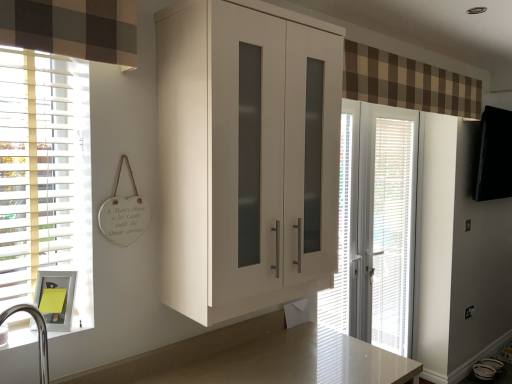
Question: Does white glossy cabinet at center have a smaller size compared to brown checkered fabric at upper center?

Choices:
 (A) yes
 (B) no

Answer: (B)

Question: Considering the relative sizes of white glossy cabinet at center and brown checkered fabric at upper center in the image provided, is white glossy cabinet at center taller than brown checkered fabric at upper center?

Choices:
 (A) yes
 (B) no

Answer: (A)

Question: Could you tell me if white glossy cabinet at center is turned towards brown checkered fabric at upper center?

Choices:
 (A) no
 (B) yes

Answer: (A)

Question: Is white glossy cabinet at center thinner than brown checkered fabric at upper center?

Choices:
 (A) yes
 (B) no

Answer: (B)

Question: Does white glossy cabinet at center have a larger size compared to brown checkered fabric at upper center?

Choices:
 (A) no
 (B) yes

Answer: (B)

Question: Is brown checkered fabric at upper center taller or shorter than white plastic blinds at right, which ranks as the first blind in back-to-front order?

Choices:
 (A) short
 (B) tall

Answer: (A)

Question: From the image's perspective, is brown checkered fabric at upper center above or below white plastic blinds at right, which is the second blind from left to right?

Choices:
 (A) above
 (B) below

Answer: (A)

Question: Considering the positions of brown checkered fabric at upper center and white plastic blinds at right, acting as the first blind starting from the right, in the image, is brown checkered fabric at upper center wider or thinner than white plastic blinds at right, acting as the first blind starting from the right,?

Choices:
 (A) thin
 (B) wide

Answer: (B)

Question: Is point (471, 99) positioned closer to the camera than point (380, 231)?

Choices:
 (A) closer
 (B) farther

Answer: (A)

Question: Is brushed metal sink at lower left bigger or smaller than brown checkered fabric at upper center?

Choices:
 (A) big
 (B) small

Answer: (B)

Question: From their relative heights in the image, would you say brushed metal sink at lower left is taller or shorter than brown checkered fabric at upper center?

Choices:
 (A) tall
 (B) short

Answer: (A)

Question: Relative to brown checkered fabric at upper center, is brushed metal sink at lower left in front or behind?

Choices:
 (A) front
 (B) behind

Answer: (A)

Question: In the image, is brushed metal sink at lower left on the left side or the right side of brown checkered fabric at upper center?

Choices:
 (A) right
 (B) left

Answer: (B)

Question: Is point (344, 170) closer or farther from the camera than point (417, 102)?

Choices:
 (A) closer
 (B) farther

Answer: (A)

Question: From their relative heights in the image, would you say white textured blind at center, the first blind in the left-to-right sequence, is taller or shorter than brown checkered fabric at upper center?

Choices:
 (A) short
 (B) tall

Answer: (B)